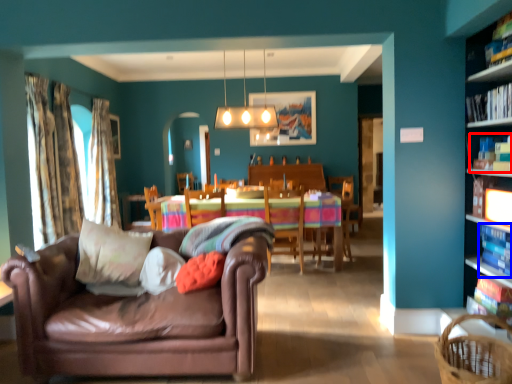
Question: Which point is further to the camera, book (highlighted by a red box) or book (highlighted by a blue box)?

Choices:
 (A) book
 (B) book

Answer: (A)